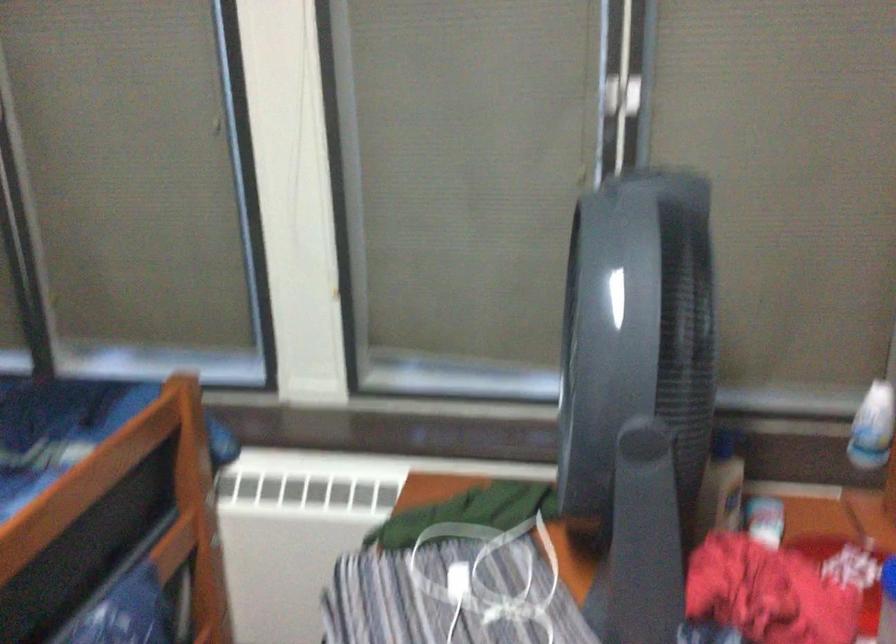
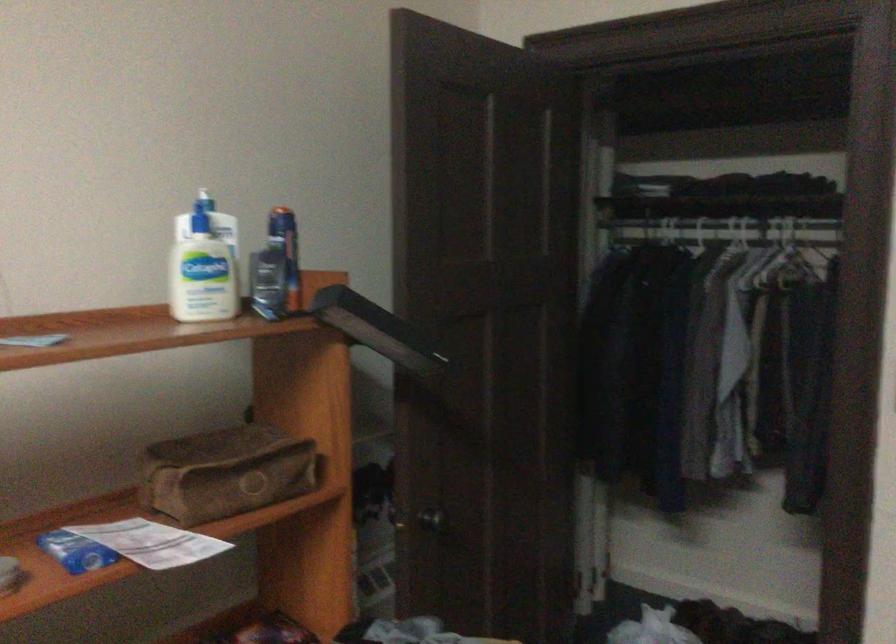
Question: The first image is from the beginning of the video and the second image is from the end. How did the camera likely rotate when shooting the video?

Choices:
 (A) Left
 (B) Right
 (C) Up
 (D) Down

Answer: (B)